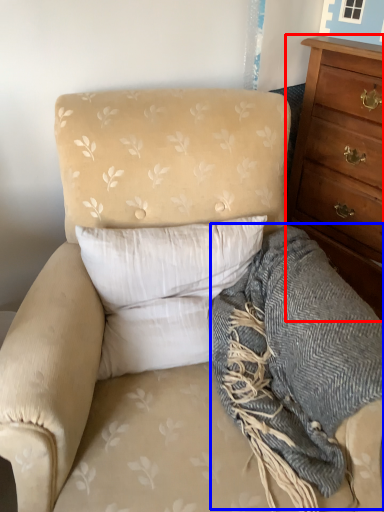
Question: Which point is closer to the camera, chest of drawers (highlighted by a red box) or blanket (highlighted by a blue box)?

Choices:
 (A) chest of drawers
 (B) blanket

Answer: (B)